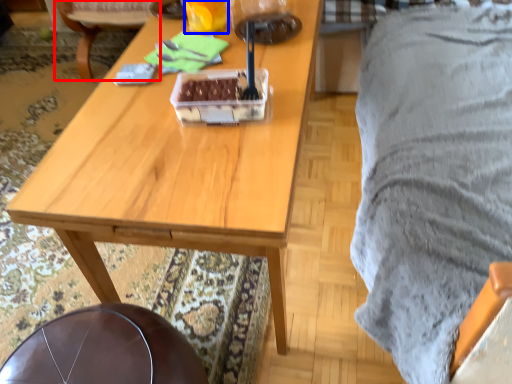
Question: Which point is further to the camera, chair (highlighted by a red box) or coffee cup (highlighted by a blue box)?

Choices:
 (A) chair
 (B) coffee cup

Answer: (A)